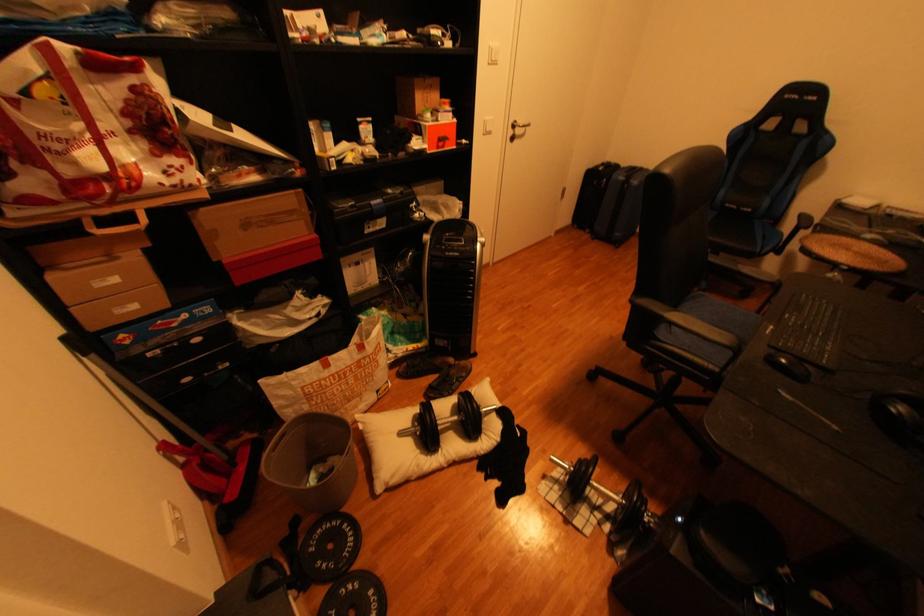
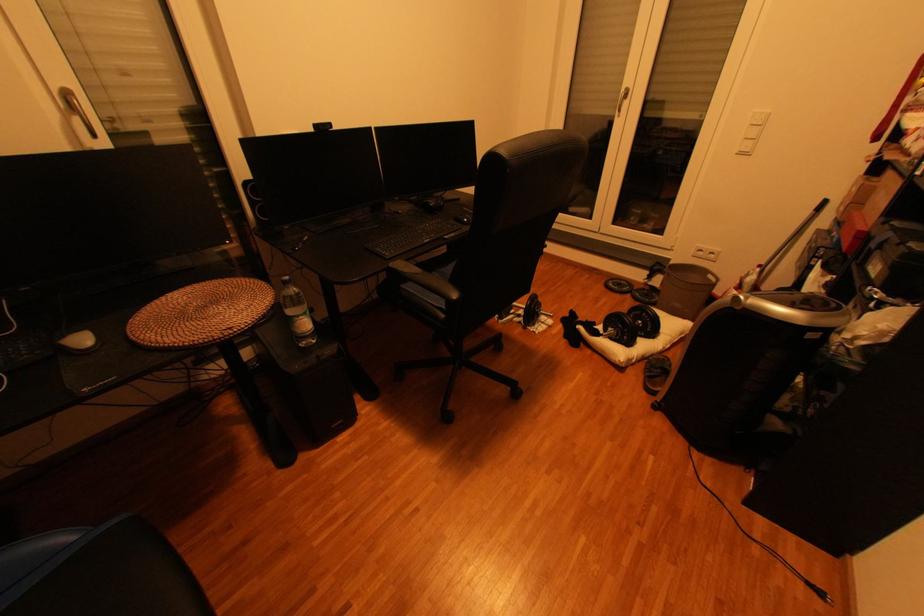
Locate, in the second image, the point that corresponds to pixel 471 378 in the first image.

(658, 373)